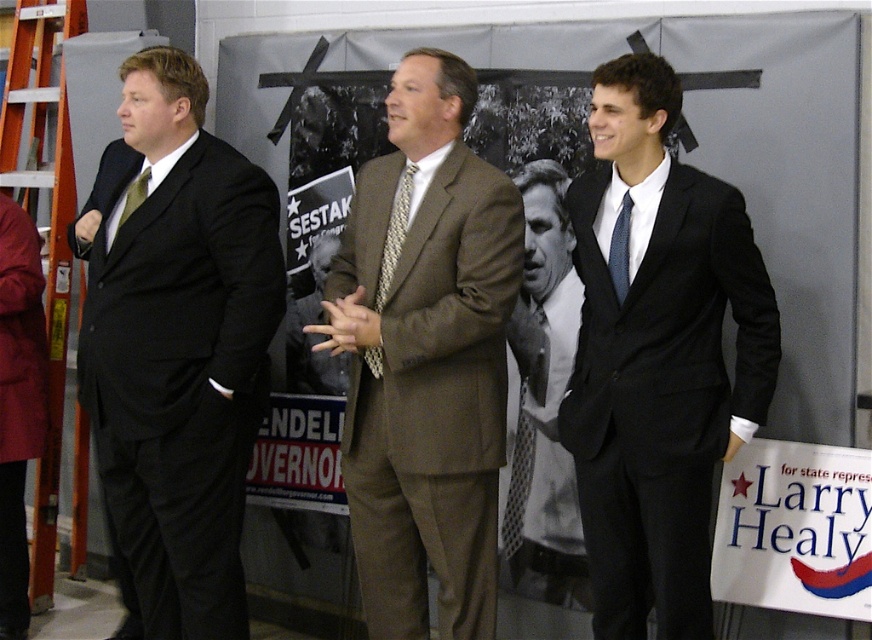
Can you confirm if black and white poster at center is thinner than blue dotted tie at right?

In fact, black and white poster at center might be wider than blue dotted tie at right.

The height and width of the screenshot is (640, 872). I want to click on black and white poster at center, so (734, 161).

Does point (695, 104) come behind point (621, 276)?

That is True.

Identify the location of black and white poster at center. (734, 161).

Can you confirm if white paper sign at lower right is shorter than orange plastic ladder at left?

Yes, white paper sign at lower right is shorter than orange plastic ladder at left.

Can you confirm if white paper sign at lower right is positioned to the left of orange plastic ladder at left?

Incorrect, white paper sign at lower right is not on the left side of orange plastic ladder at left.

The width and height of the screenshot is (872, 640). I want to click on white paper sign at lower right, so click(794, 529).

At what (x,y) coordinates should I click in order to perform the action: click on white paper sign at lower right. Please return your answer as a coordinate pair (x, y). Looking at the image, I should click on (794, 529).

Is point (666, 218) positioned in front of point (65, 141)?

Yes, point (666, 218) is closer to viewer.

Can you confirm if matte black suit at right is positioned to the right of orange plastic ladder at left?

Indeed, matte black suit at right is positioned on the right side of orange plastic ladder at left.

Is point (646, 593) positioned before point (41, 572)?

Yes, it is in front of point (41, 572).

Locate an element on the screen. This screenshot has width=872, height=640. matte black suit at right is located at coordinates tap(658, 356).